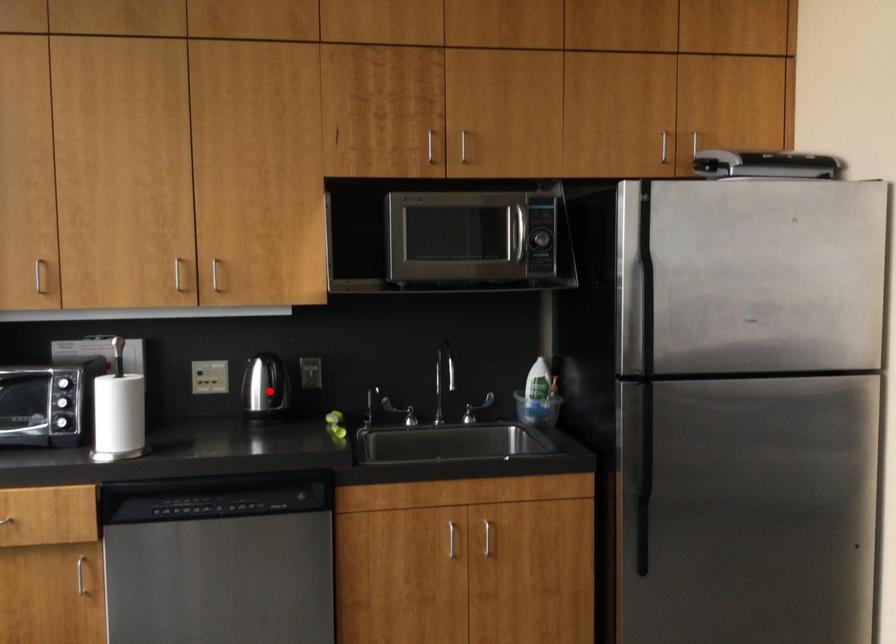
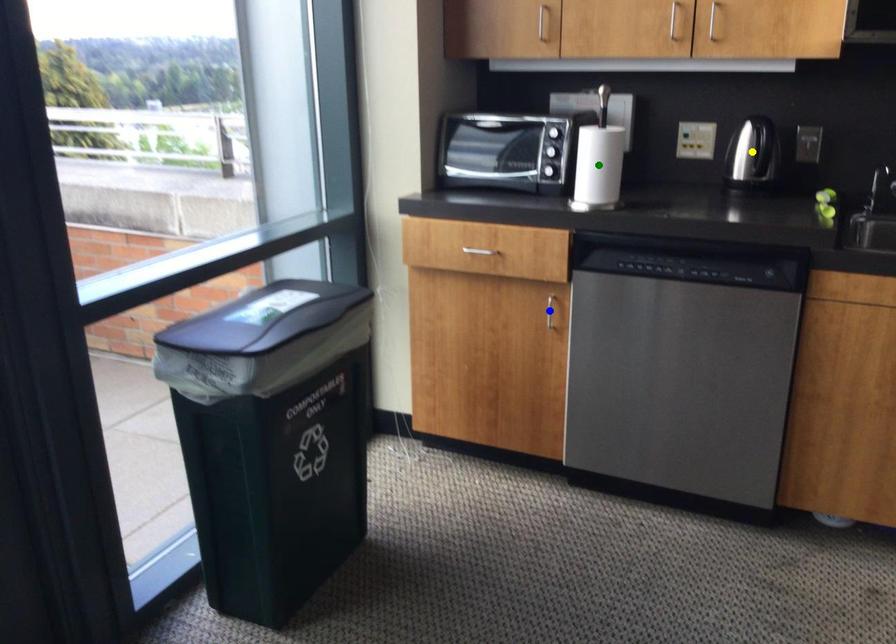
Question: I am providing you with two images of the same scene from different viewpoints. A red point is marked on the first image. You are given multiple points on the second image. Which point in image 2 is actually the same real-world point as the red point in image 1?

Choices:
 (A) blue point
 (B) green point
 (C) yellow point

Answer: (C)